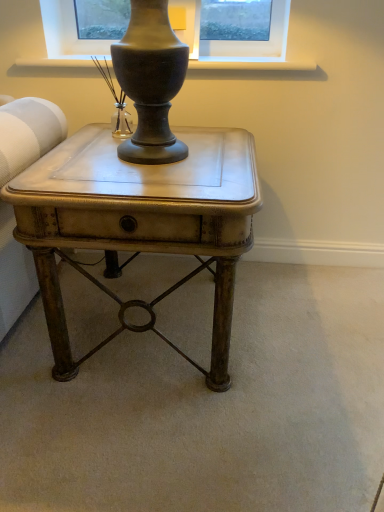
Question: Is matte wood window sill at upper center thinner than matte brown side table at center?

Choices:
 (A) no
 (B) yes

Answer: (B)

Question: Considering the relative sizes of matte wood window sill at upper center and matte brown side table at center in the image provided, is matte wood window sill at upper center wider than matte brown side table at center?

Choices:
 (A) no
 (B) yes

Answer: (A)

Question: Is matte wood window sill at upper center further to camera compared to matte brown side table at center?

Choices:
 (A) no
 (B) yes

Answer: (B)

Question: From a real-world perspective, is matte wood window sill at upper center over matte brown side table at center?

Choices:
 (A) no
 (B) yes

Answer: (B)

Question: Can you confirm if matte wood window sill at upper center is taller than matte brown side table at center?

Choices:
 (A) no
 (B) yes

Answer: (A)

Question: Is matte wood window sill at upper center oriented away from matte brown side table at center?

Choices:
 (A) yes
 (B) no

Answer: (B)

Question: Is matte wood window sill at upper center completely or partially inside matte brown side table at center?

Choices:
 (A) no
 (B) yes

Answer: (A)

Question: Considering the relative positions of matte brown side table at center and matte wood window sill at upper center in the image provided, is matte brown side table at center to the left of matte wood window sill at upper center from the viewer's perspective?

Choices:
 (A) no
 (B) yes

Answer: (B)

Question: From the image's perspective, does matte brown side table at center appear lower than matte wood window sill at upper center?

Choices:
 (A) no
 (B) yes

Answer: (B)

Question: Can you confirm if matte brown side table at center is smaller than matte wood window sill at upper center?

Choices:
 (A) yes
 (B) no

Answer: (B)

Question: Is matte brown side table at center positioned in front of matte wood window sill at upper center?

Choices:
 (A) no
 (B) yes

Answer: (B)

Question: Is matte brown side table at center oriented towards matte wood window sill at upper center?

Choices:
 (A) yes
 (B) no

Answer: (B)

Question: From the image's perspective, relative to matte wood window sill at upper center, is matte brown side table at center above or below?

Choices:
 (A) below
 (B) above

Answer: (A)